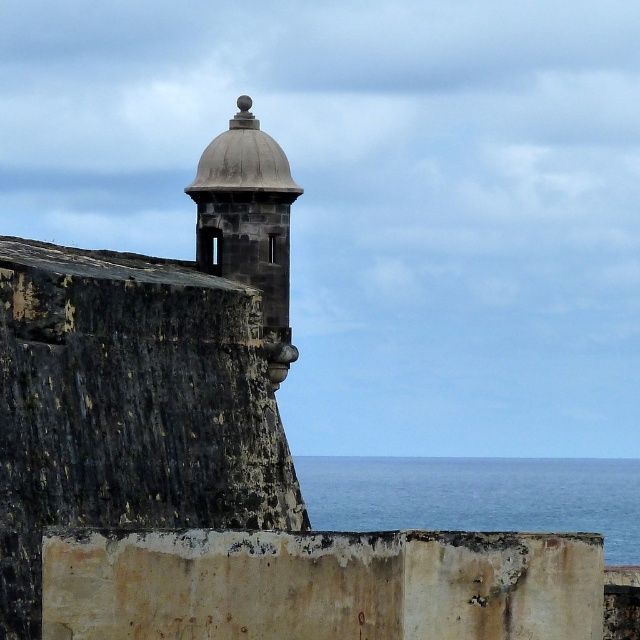
Which is behind, point (444, 458) or point (244, 188)?

Positioned behind is point (444, 458).

Does blue water at center appear under smooth stone tower at upper center?

Indeed, blue water at center is positioned under smooth stone tower at upper center.

What do you see at coordinates (477, 496) in the screenshot? I see `blue water at center` at bounding box center [477, 496].

What are the coordinates of `blue water at center` in the screenshot? It's located at [x=477, y=496].